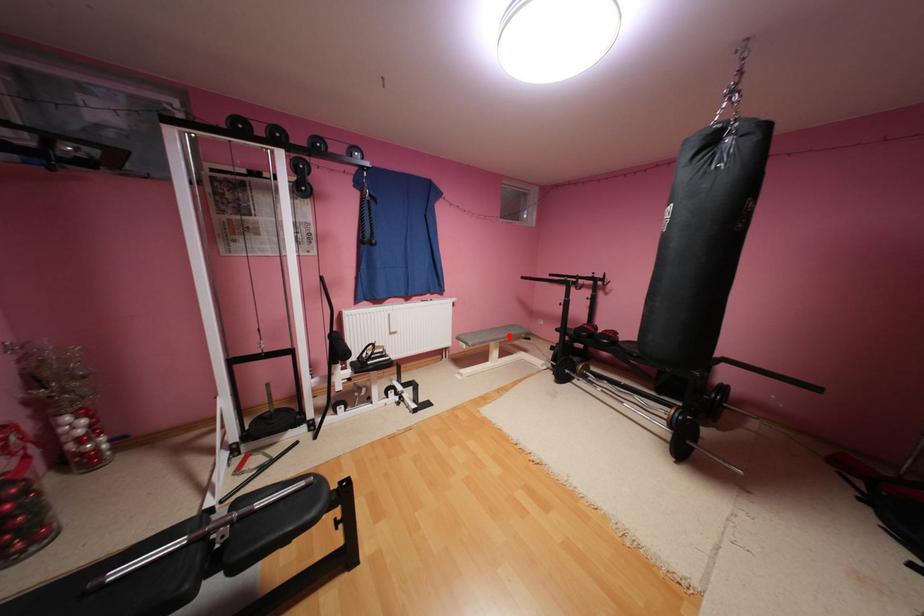
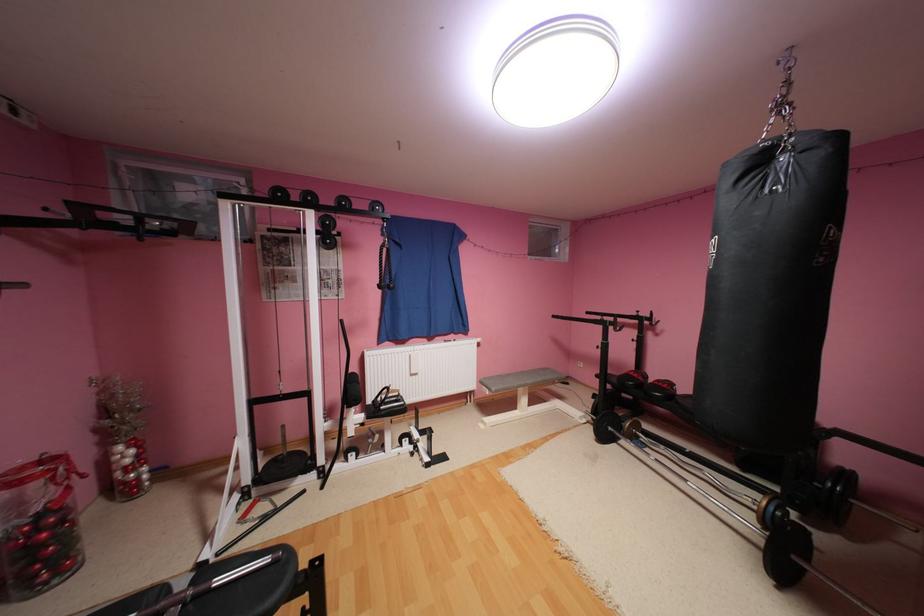
In the second image, find the point that corresponds to the highlighted location in the first image.

(538, 382)